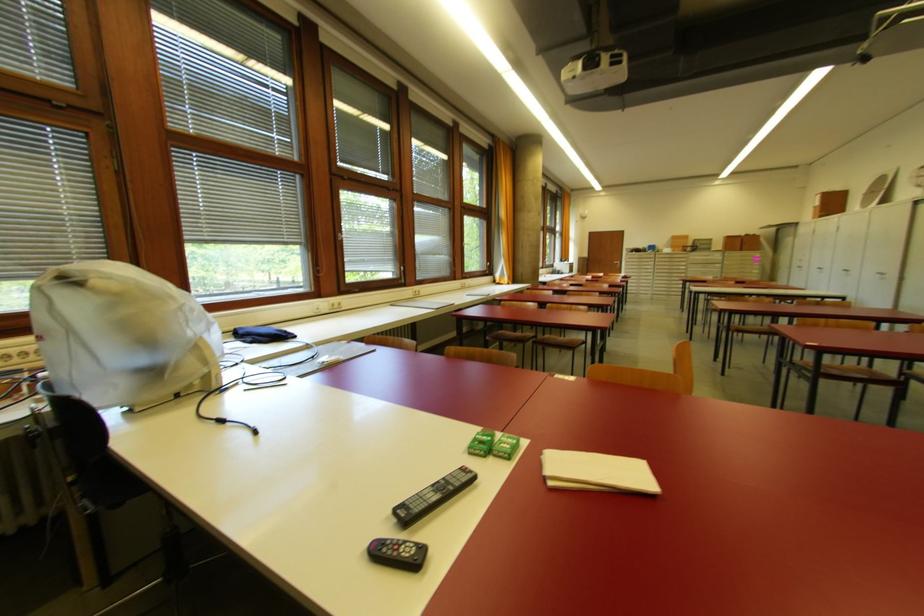
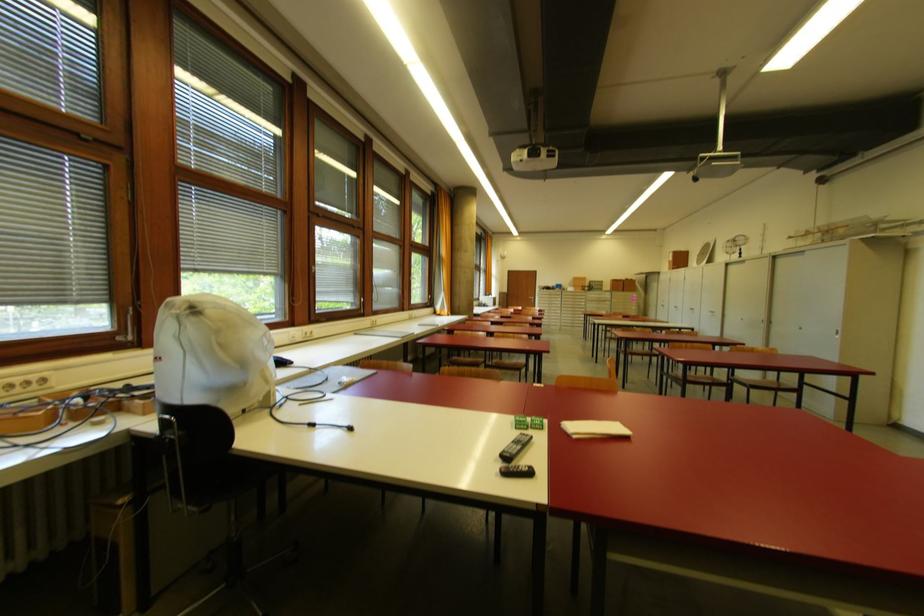
Locate, in the second image, the point that corresponds to pixel 757 237 in the first image.

(634, 281)